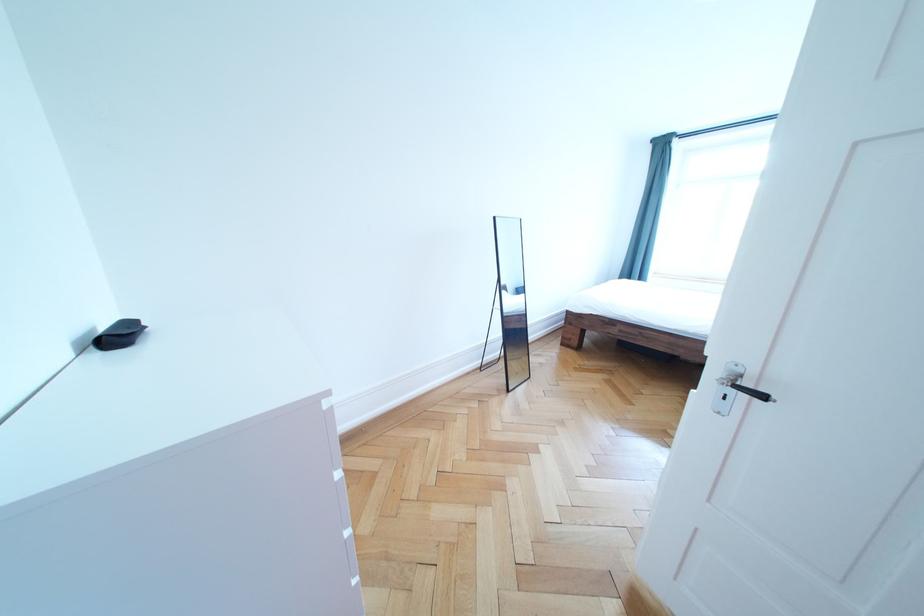
The height and width of the screenshot is (616, 924). What do you see at coordinates (750, 392) in the screenshot?
I see `the black door handle` at bounding box center [750, 392].